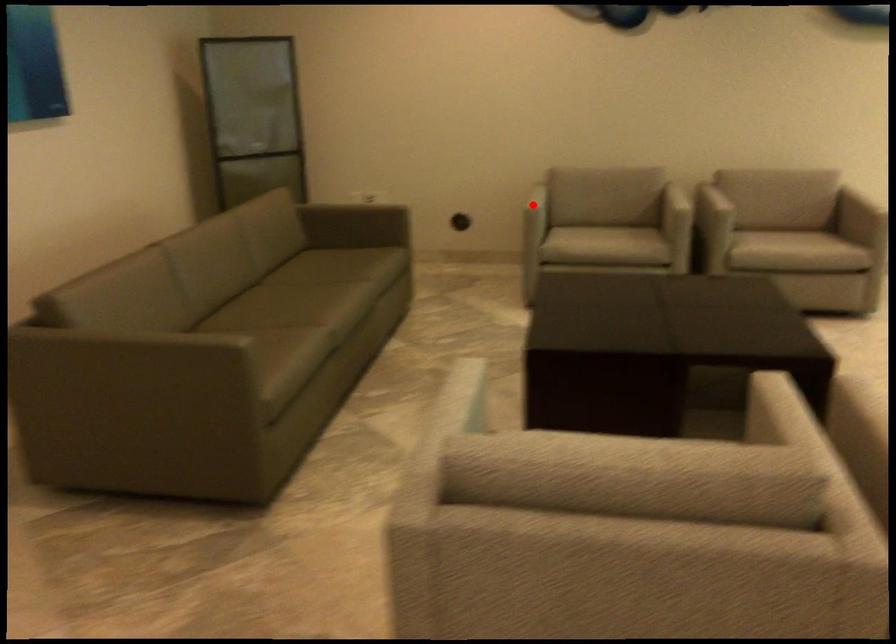
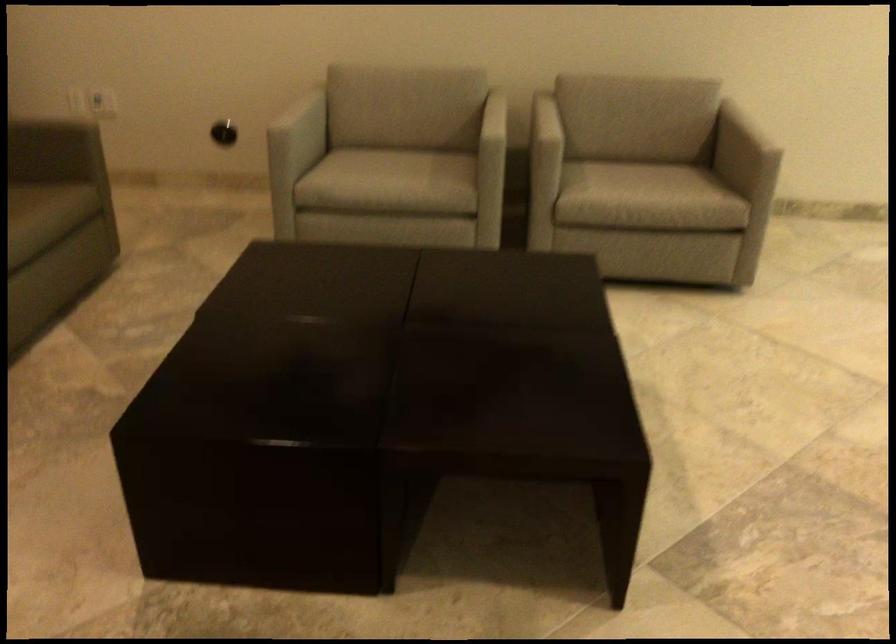
The point at the highlighted location is marked in the first image. Where is the corresponding point in the second image?

(304, 124)